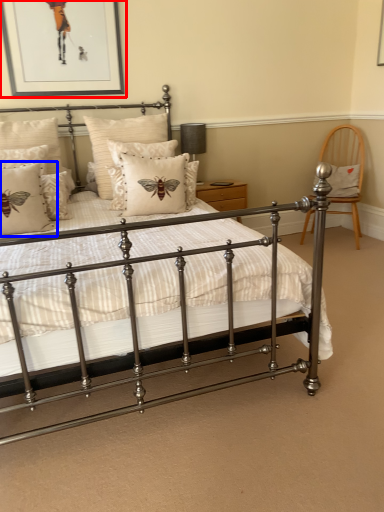
Question: Which point is further to the camera, picture frame (highlighted by a red box) or pillow (highlighted by a blue box)?

Choices:
 (A) picture frame
 (B) pillow

Answer: (A)